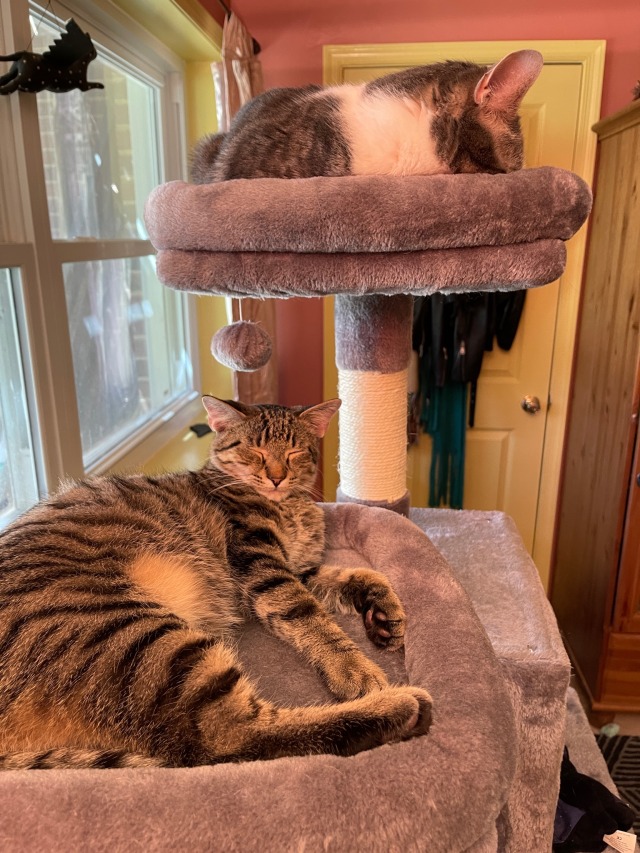
Where is `door frame`? The width and height of the screenshot is (640, 853). door frame is located at coordinates (577, 50).